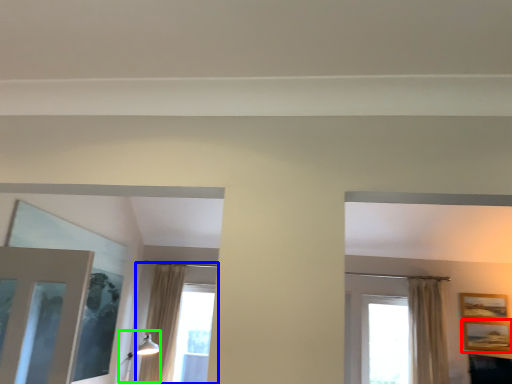
Question: Which object is positioned closest to picture frame (highlighted by a red box)? Select from window (highlighted by a blue box) and light fixture (highlighted by a green box).

Choices:
 (A) window
 (B) light fixture

Answer: (B)